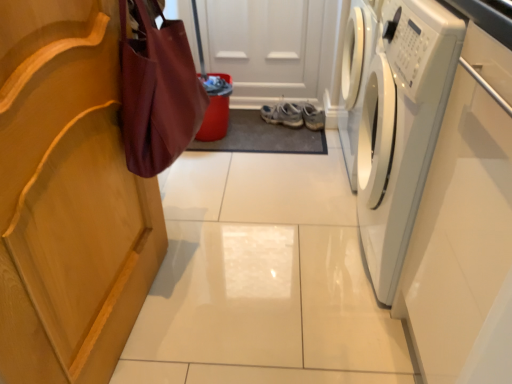
Question: Is point (276, 119) positioned closer to the camera than point (167, 153)?

Choices:
 (A) closer
 (B) farther

Answer: (B)

Question: Is light blue fabric sneakers at center in front of or behind burgundy fabric bag at left in the image?

Choices:
 (A) front
 (B) behind

Answer: (B)

Question: Considering the real-world distances, which object is farthest from the light blue fabric sneakers at center?

Choices:
 (A) white glossy washing machine at right
 (B) burgundy fabric bag at left

Answer: (B)

Question: Which object is positioned farthest from the white glossy washing machine at right?

Choices:
 (A) light blue fabric sneakers at center
 (B) burgundy fabric bag at left

Answer: (A)